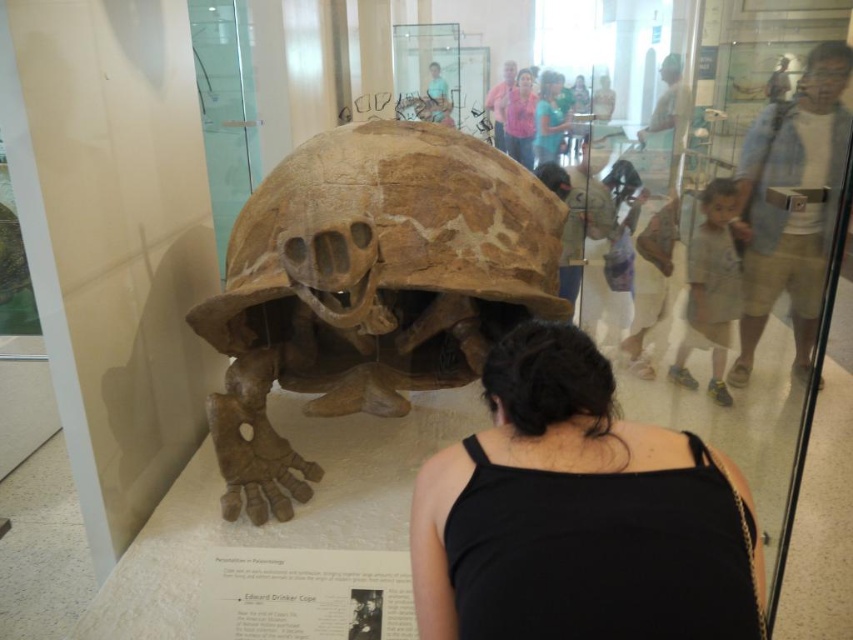
You are a museum visitor standing in front of the exhibit. You want to take a photo of the fossilized tortoise shell and leg without any obstruction. Is the black fabric at center in your way?

The black fabric at center is 1.84 meters away from you, so it is not close enough to obstruct your view of the fossilized tortoise shell and leg. You can take the photo without any obstruction.

You are a visitor in the museum and want to take a photo of the tortoise exhibit without any people blocking the view. You notice the black fabric at center and the pink fabric shirt at upper center in your shot. Which fabric should you move to the right to avoid blocking the exhibit?

The black fabric at center is positioned on the left side of pink fabric shirt at upper center. To avoid blocking the exhibit, you should move the black fabric at center to the right so it doesn not overlap with the exhibit area.